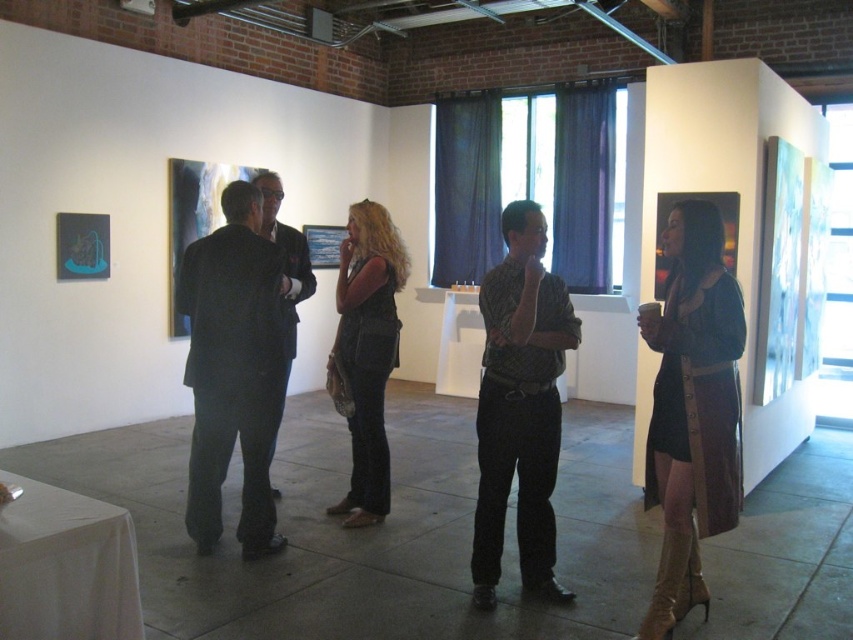
Who is positioned more to the left, dark gray suit at left or dark green textured shirt at center?

dark gray suit at left is more to the left.

How much distance is there between dark gray suit at left and dark green textured shirt at center?

The distance of dark gray suit at left from dark green textured shirt at center is 4.07 feet.

At what (x,y) coordinates should I click in order to perform the action: click on dark gray suit at left. Please return your answer as a coordinate pair (x, y). Looking at the image, I should click on (233, 371).

Between point (544, 321) and point (273, 493), which one is positioned behind?

Point (273, 493)

I want to click on dark green textured shirt at center, so click(x=520, y=406).

Where is `dark green textured shirt at center`? This screenshot has width=853, height=640. dark green textured shirt at center is located at coordinates (520, 406).

Who is shorter, leather dress at center or dark green textured shirt at center?

Standing shorter between the two is leather dress at center.

Locate an element on the screen. The image size is (853, 640). leather dress at center is located at coordinates (692, 410).